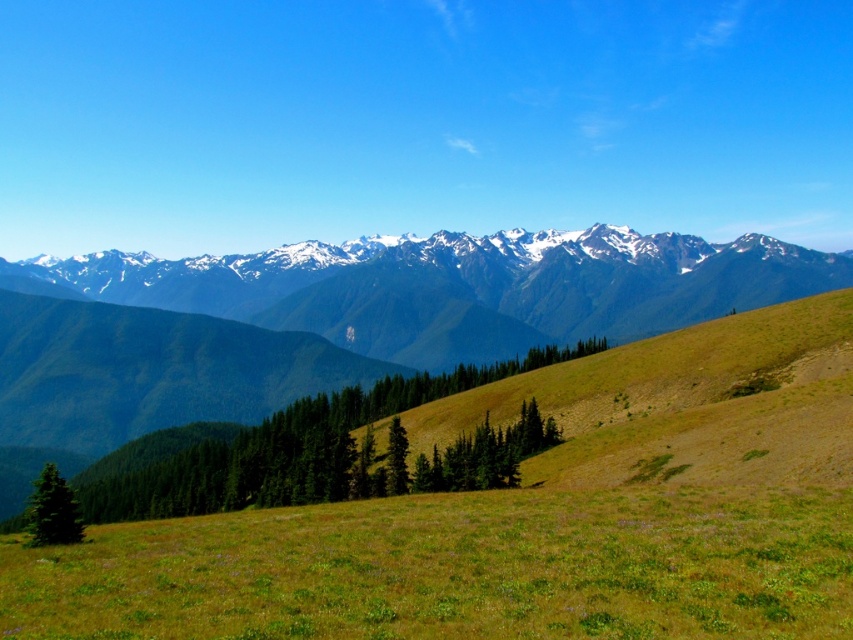
You are standing on the green grassy field at lower center and want to reach the green textured tree at center. Which direction should you move to get closer to the tree?

Since the green grassy field at lower center is taller than the green textured tree at center, you should move upward to get closer to the tree.

You are planning to set up a tent for a camping trip. You have two possible spots available. One is on the green grassy field at lower center and the other is near the green textured tree at center. Which location would provide more space for your tent?

The green grassy field at lower center might be wider than the green textured tree at center, so it would provide more space for your tent.

You are an outdoor enthusiast planning to hike to the base of the green textured mountains at upper center. You notice the green textured tree at center blocking your path. Can you walk around it to reach the mountains?

The green textured tree at center is behind the green textured mountains at upper center, so you cannot walk around it to reach the mountains because the tree is already behind the mountains, meaning it is further away from your current position.